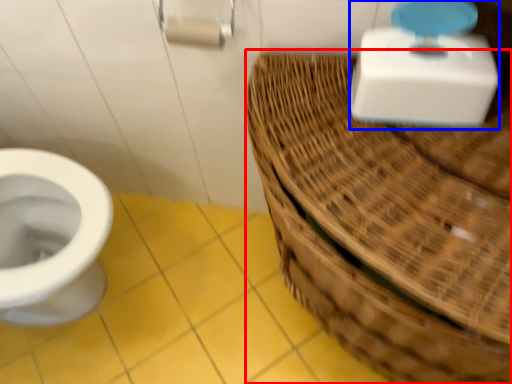
Question: Which object is closer to the camera taking this photo, basket (highlighted by a red box) or scale (highlighted by a blue box)?

Choices:
 (A) basket
 (B) scale

Answer: (A)